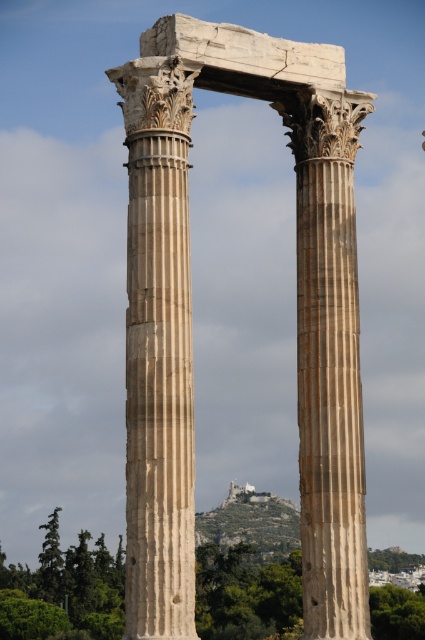
Can you confirm if marble column at center is shorter than beige marble column at center?

Answer: In fact, marble column at center may be taller than beige marble column at center.

Does marble column at center have a greater width compared to beige marble column at center?

Correct, the width of marble column at center exceeds that of beige marble column at center.

Is point (183, 241) behind point (343, 456)?

That is False.

You are a GUI agent. You are given a task and a screenshot of the screen. Output one action in this format:
    pyautogui.click(x=<x>, y=<y>)
    Task: Click on the marble column at center
    
    Given the screenshot: What is the action you would take?
    pyautogui.click(x=158, y=349)

Is beige stone columns at center further to the viewer compared to beige marble column at center?

No, it is not.

Does point (187, 244) lie behind point (317, 260)?

No, (187, 244) is closer to viewer.

At what (x,y) coordinates should I click in order to perform the action: click on beige stone columns at center. Please return your answer as a coordinate pair (x, y). This screenshot has width=425, height=640. Looking at the image, I should click on (190, 317).

Looking at this image, can you confirm if beige stone columns at center is thinner than marble column at center?

No, beige stone columns at center is not thinner than marble column at center.

Which is above, beige stone columns at center or marble column at center?

beige stone columns at center is above.

You are a GUI agent. You are given a task and a screenshot of the screen. Output one action in this format:
    pyautogui.click(x=<x>, y=<y>)
    Task: Click on the beige stone columns at center
    
    Given the screenshot: What is the action you would take?
    pyautogui.click(x=190, y=317)